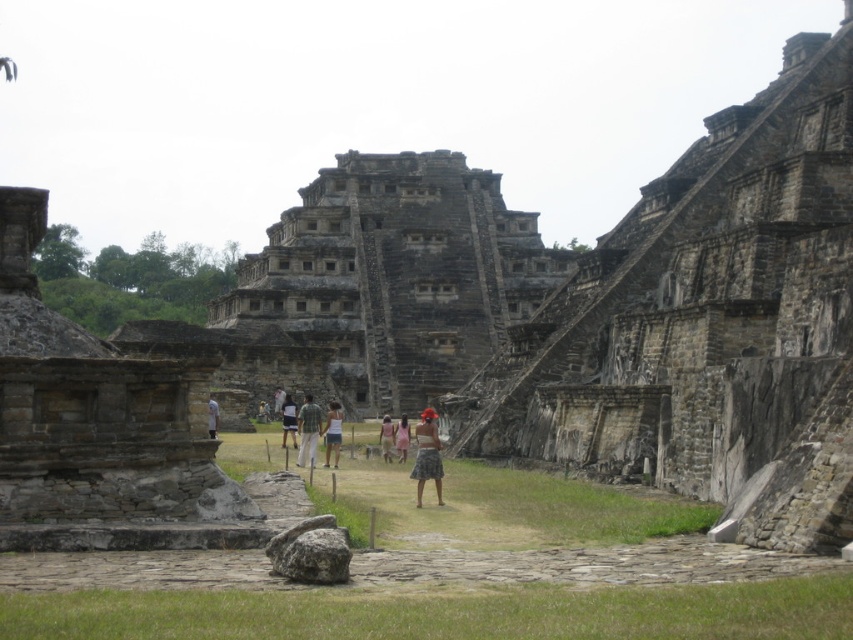
Can you confirm if dark gray stone ruins at center is bigger than light brown stone person at center?

Yes.

Is point (368, 390) more distant than point (213, 406)?

Yes, point (368, 390) is behind point (213, 406).

Who is more distant from viewer, [346,307] or [212,397]?

The point [346,307] is more distant.

Identify the location of dark gray stone ruins at center. The image size is (853, 640). (396, 275).

Between green plaid shirt at center and pink fabric skirt at center, which one appears on the left side from the viewer's perspective?

From the viewer's perspective, green plaid shirt at center appears more on the left side.

Does point (308, 406) come farther from viewer compared to point (386, 419)?

No, (308, 406) is in front of (386, 419).

This screenshot has width=853, height=640. Describe the element at coordinates (308, 432) in the screenshot. I see `green plaid shirt at center` at that location.

Find the location of `green plaid shirt at center`. green plaid shirt at center is located at coordinates (308, 432).

Looking at this image, between gray stone ruins at center and plaid skirt at center, which one has less height?

Standing shorter between the two is plaid skirt at center.

Who is more forward, [671,486] or [415,465]?

Point [415,465]

This screenshot has width=853, height=640. Identify the location of gray stone ruins at center. (706, 324).